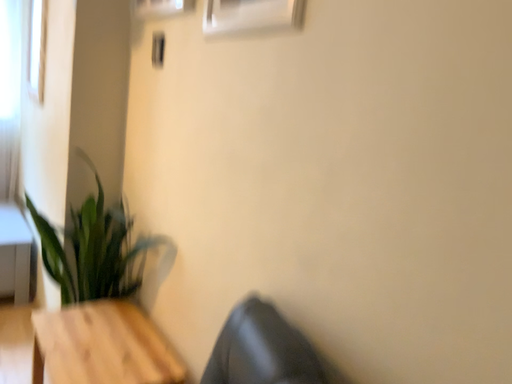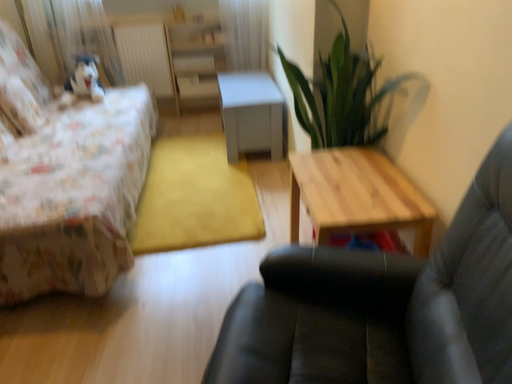
Question: How did the camera likely rotate when shooting the video?

Choices:
 (A) rotated left
 (B) rotated right

Answer: (A)